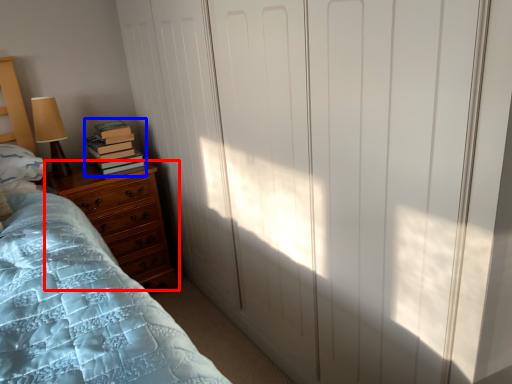
Question: Which object appears closest to the camera in this image, chest of drawers (highlighted by a red box) or book (highlighted by a blue box)?

Choices:
 (A) chest of drawers
 (B) book

Answer: (A)